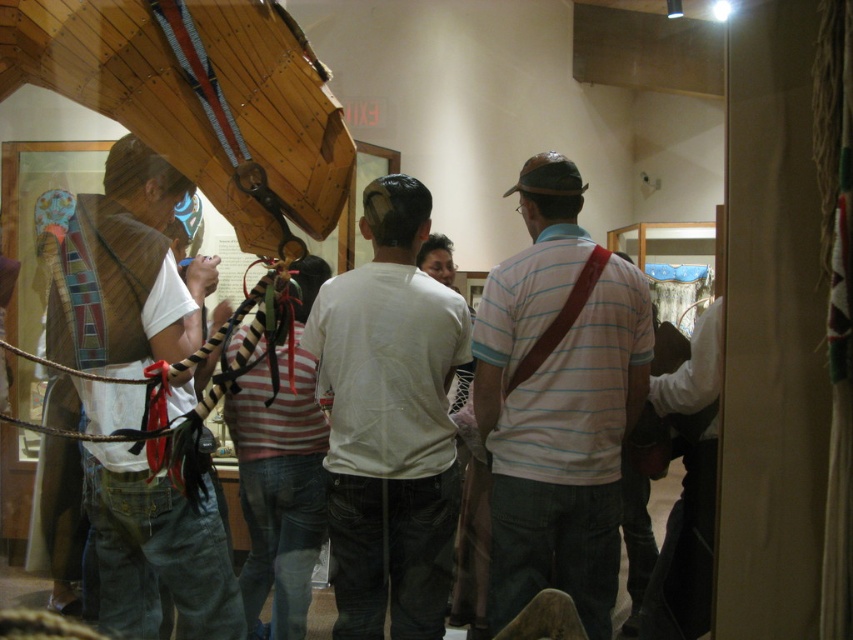
Question: Does white striped shirt at center come in front of white matte shirt at center?

Choices:
 (A) no
 (B) yes

Answer: (B)

Question: Estimate the real-world distances between objects in this image. Which object is farther from the white striped shirt at center?

Choices:
 (A) white matte shirt at center
 (B) matte brown vest at left

Answer: (B)

Question: Among these points, which one is nearest to the camera?

Choices:
 (A) (531, 193)
 (B) (422, 513)
 (C) (103, 428)

Answer: (C)

Question: Which point is closer to the camera taking this photo?

Choices:
 (A) (489, 291)
 (B) (183, 308)

Answer: (B)

Question: Is white matte shirt at center smaller than matte brown vest at left?

Choices:
 (A) no
 (B) yes

Answer: (B)

Question: Does white striped shirt at center have a lesser width compared to white matte shirt at center?

Choices:
 (A) yes
 (B) no

Answer: (B)